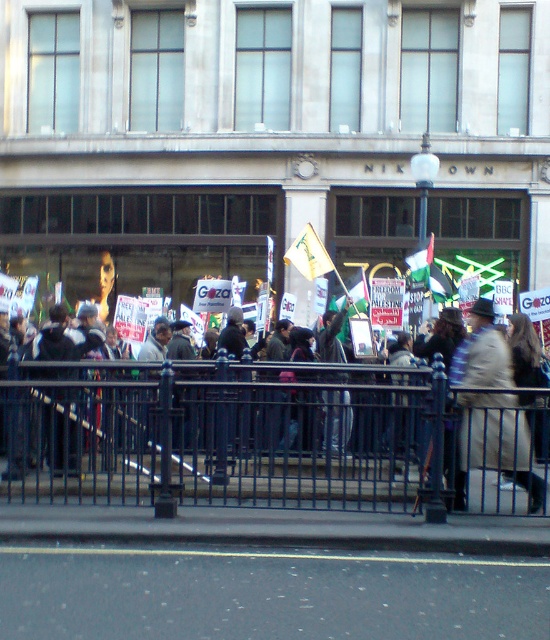
Question: Is black metal fence at center bigger than dark gray hoodie at center?

Choices:
 (A) no
 (B) yes

Answer: (B)

Question: Can you confirm if black metal fence at center is wider than dark gray hoodie at center?

Choices:
 (A) no
 (B) yes

Answer: (B)

Question: Estimate the real-world distances between objects in this image. Which object is farther from the dark gray hoodie at center?

Choices:
 (A) light brown leather coat at center
 (B) black metal fence at center

Answer: (A)

Question: In this image, where is black metal fence at center located relative to dark gray hoodie at center?

Choices:
 (A) left
 (B) right

Answer: (B)

Question: Considering the real-world distances, which object is farthest from the dark gray hoodie at center?

Choices:
 (A) light brown leather coat at center
 (B) black metal fence at center

Answer: (A)

Question: Which point appears farthest from the camera in this image?

Choices:
 (A) (500, 368)
 (B) (85, 314)
 (C) (35, 404)

Answer: (B)